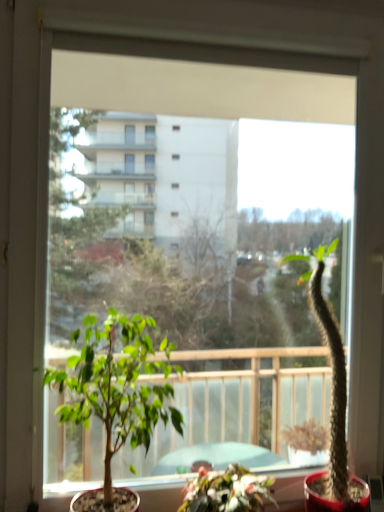
At what (x,y) coordinates should I click in order to perform the action: click on green leafy plant at center, which appears as the 3th houseplant when viewed from the right. Please return your answer as a coordinate pair (x, y). The height and width of the screenshot is (512, 384). Looking at the image, I should click on (117, 387).

Identify the location of green matte plant at center, which appears as the second houseplant when viewed from the left. The height and width of the screenshot is (512, 384). (227, 490).

The image size is (384, 512). I want to click on green succulent at right, the 3th houseplant positioned from the left, so click(x=331, y=405).

Where is `green leafy plant at center, positioned as the 1th houseplant in left-to-right order`? This screenshot has height=512, width=384. green leafy plant at center, positioned as the 1th houseplant in left-to-right order is located at coordinates click(x=117, y=387).

From a real-world perspective, is green leafy plant at center, which appears as the 3th houseplant when viewed from the right, on top of green matte plant at center, which appears as the second houseplant when viewed from the left?

Answer: Yes, from a real-world perspective, green leafy plant at center, which appears as the 3th houseplant when viewed from the right, is above green matte plant at center, which appears as the second houseplant when viewed from the left.

Is green leafy plant at center, positioned as the 1th houseplant in left-to-right order, wider than green matte plant at center, which appears as the second houseplant when viewed from the left?

Incorrect, the width of green leafy plant at center, positioned as the 1th houseplant in left-to-right order, does not surpass that of green matte plant at center, which appears as the second houseplant when viewed from the left.

From the image's perspective, is green leafy plant at center, which appears as the 3th houseplant when viewed from the right, beneath green matte plant at center, which appears as the second houseplant when viewed from the left?

Actually, green leafy plant at center, which appears as the 3th houseplant when viewed from the right, appears above green matte plant at center, which appears as the second houseplant when viewed from the left, in the image.

This screenshot has height=512, width=384. I want to click on houseplant located underneath the green leafy plant at center, which appears as the 3th houseplant when viewed from the right (from a real-world perspective), so click(x=227, y=490).

Can you confirm if green matte plant at center, which appears as the second houseplant when viewed from the left, is taller than green leafy plant at center, which appears as the 3th houseplant when viewed from the right?

In fact, green matte plant at center, which appears as the second houseplant when viewed from the left, may be shorter than green leafy plant at center, which appears as the 3th houseplant when viewed from the right.

Which object is positioned more to the right, green matte plant at center, which appears as the second houseplant when viewed from the left, or green leafy plant at center, which appears as the 3th houseplant when viewed from the right?

green matte plant at center, which appears as the second houseplant when viewed from the left.

Is green leafy plant at center, positioned as the 1th houseplant in left-to-right order, not near green succulent at right, the 3th houseplant positioned from the left?

That's not correct — green leafy plant at center, positioned as the 1th houseplant in left-to-right order, is a little close to green succulent at right, the 3th houseplant positioned from the left.

From the image's perspective, which houseplant is the 1st one below the green succulent at right, the first houseplant when ordered from right to left? Please provide its 2D coordinates.

[(117, 387)]

From the picture: From the image's perspective, is green leafy plant at center, positioned as the 1th houseplant in left-to-right order, beneath green succulent at right, the first houseplant when ordered from right to left?

Indeed, from the image's perspective, green leafy plant at center, positioned as the 1th houseplant in left-to-right order, is shown beneath green succulent at right, the first houseplant when ordered from right to left.

Measure the distance from green leafy plant at center, which appears as the 3th houseplant when viewed from the right, to green succulent at right, the first houseplant when ordered from right to left.

green leafy plant at center, which appears as the 3th houseplant when viewed from the right, is 22.48 inches from green succulent at right, the first houseplant when ordered from right to left.

From a real-world perspective, which object stands above the other?

green succulent at right, the first houseplant when ordered from right to left, from a real-world perspective.

Starting from the green succulent at right, the 3th houseplant positioned from the left, which houseplant is the 1st one in front? Please provide its 2D coordinates.

[(227, 490)]

Is green matte plant at center, the second houseplant in the right-to-left sequence, oriented towards green succulent at right, the first houseplant when ordered from right to left?

→ No, green matte plant at center, the second houseplant in the right-to-left sequence, does not turn towards green succulent at right, the first houseplant when ordered from right to left.

Is green succulent at right, the first houseplant when ordered from right to left, shorter than green matte plant at center, the second houseplant in the right-to-left sequence?

No, green succulent at right, the first houseplant when ordered from right to left, is not shorter than green matte plant at center, the second houseplant in the right-to-left sequence.

Is green succulent at right, the 3th houseplant positioned from the left, oriented towards green matte plant at center, which appears as the second houseplant when viewed from the left?

No, green succulent at right, the 3th houseplant positioned from the left, is not oriented towards green matte plant at center, which appears as the second houseplant when viewed from the left.

Considering the relative positions of green succulent at right, the 3th houseplant positioned from the left, and green matte plant at center, the second houseplant in the right-to-left sequence, in the image provided, is green succulent at right, the 3th houseplant positioned from the left, to the left of green matte plant at center, the second houseplant in the right-to-left sequence, from the viewer's perspective?

Incorrect, green succulent at right, the 3th houseplant positioned from the left, is not on the left side of green matte plant at center, the second houseplant in the right-to-left sequence.

How different are the orientations of green succulent at right, the first houseplant when ordered from right to left, and green matte plant at center, which appears as the second houseplant when viewed from the left, in degrees?

The angle between the facing direction of green succulent at right, the first houseplant when ordered from right to left, and the facing direction of green matte plant at center, which appears as the second houseplant when viewed from the left, is 0.0256 degrees.

Is there a large distance between green succulent at right, the 3th houseplant positioned from the left, and green leafy plant at center, which appears as the 3th houseplant when viewed from the right?

green succulent at right, the 3th houseplant positioned from the left, is near green leafy plant at center, which appears as the 3th houseplant when viewed from the right, not far away.

Is green succulent at right, the 3th houseplant positioned from the left, facing towards green leafy plant at center, positioned as the 1th houseplant in left-to-right order?

No, green succulent at right, the 3th houseplant positioned from the left, is not aimed at green leafy plant at center, positioned as the 1th houseplant in left-to-right order.

Which houseplant is the 2nd one when counting from the front of the green succulent at right, the first houseplant when ordered from right to left? Please provide its 2D coordinates.

[(117, 387)]

Can you confirm if green succulent at right, the first houseplant when ordered from right to left, is positioned to the left of green leafy plant at center, positioned as the 1th houseplant in left-to-right order?

No.

Which houseplant is the 1st one when counting from the back of the green leafy plant at center, positioned as the 1th houseplant in left-to-right order? Please provide its 2D coordinates.

[(227, 490)]

Starting from the green leafy plant at center, which appears as the 3th houseplant when viewed from the right, which houseplant is the 1st one to the right? Please provide its 2D coordinates.

[(227, 490)]

Based on their spatial positions, is green leafy plant at center, which appears as the 3th houseplant when viewed from the right, or green matte plant at center, which appears as the second houseplant when viewed from the left, closer to green succulent at right, the first houseplant when ordered from right to left?

green matte plant at center, which appears as the second houseplant when viewed from the left, is closer to green succulent at right, the first houseplant when ordered from right to left.

From the image, which object appears to be farther from green leafy plant at center, which appears as the 3th houseplant when viewed from the right, green matte plant at center, which appears as the second houseplant when viewed from the left, or green succulent at right, the first houseplant when ordered from right to left?

green succulent at right, the first houseplant when ordered from right to left, is positioned further to the anchor green leafy plant at center, which appears as the 3th houseplant when viewed from the right.

Estimate the real-world distances between objects in this image. Which object is further from green leafy plant at center, which appears as the 3th houseplant when viewed from the right, green succulent at right, the 3th houseplant positioned from the left, or green matte plant at center, which appears as the second houseplant when viewed from the left?

Among the two, green succulent at right, the 3th houseplant positioned from the left, is located further to green leafy plant at center, which appears as the 3th houseplant when viewed from the right.

Which object lies nearer to the anchor point green succulent at right, the 3th houseplant positioned from the left, green matte plant at center, the second houseplant in the right-to-left sequence, or green leafy plant at center, positioned as the 1th houseplant in left-to-right order?

The object closer to green succulent at right, the 3th houseplant positioned from the left, is green matte plant at center, the second houseplant in the right-to-left sequence.

In the scene shown: Considering their positions, is green leafy plant at center, positioned as the 1th houseplant in left-to-right order, positioned closer to green matte plant at center, which appears as the second houseplant when viewed from the left, than green succulent at right, the 3th houseplant positioned from the left?

green succulent at right, the 3th houseplant positioned from the left.

Looking at the image, which one is located closer to green matte plant at center, the second houseplant in the right-to-left sequence, green succulent at right, the 3th houseplant positioned from the left, or green leafy plant at center, which appears as the 3th houseplant when viewed from the right?

green succulent at right, the 3th houseplant positioned from the left, is closer to green matte plant at center, the second houseplant in the right-to-left sequence.

In order to click on houseplant between green leafy plant at center, which appears as the 3th houseplant when viewed from the right, and green succulent at right, the 3th houseplant positioned from the left, in the horizontal direction in this screenshot , I will do `click(227, 490)`.